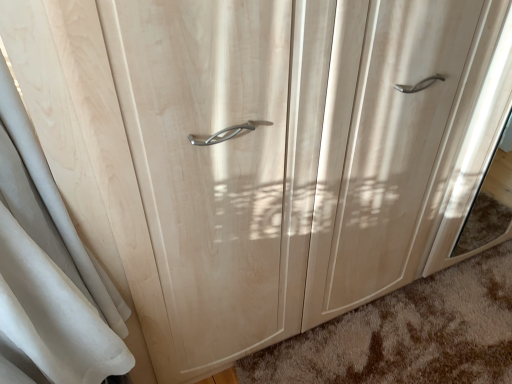
The width and height of the screenshot is (512, 384). Identify the location of transparent glass screen door at right. (477, 132).

What do you see at coordinates (477, 132) in the screenshot?
I see `transparent glass screen door at right` at bounding box center [477, 132].

The width and height of the screenshot is (512, 384). What are the coordinates of `transparent glass screen door at right` in the screenshot? It's located at (477, 132).